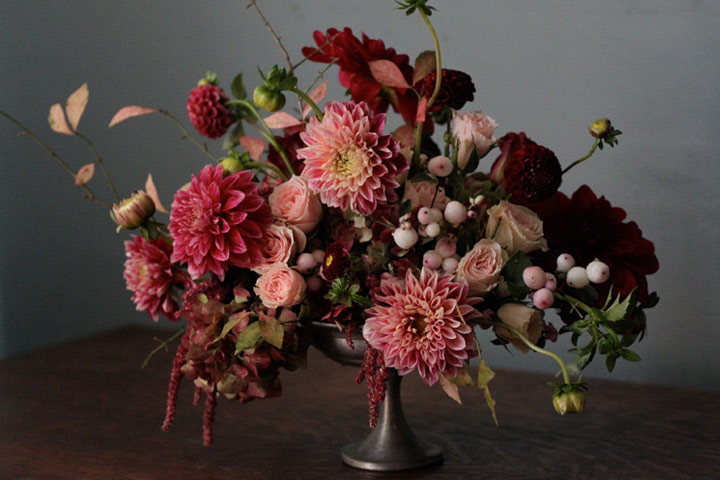
At what (x,y) coordinates should I click in order to perform the action: click on wall. Please return your answer as a coordinate pair (x, y). The height and width of the screenshot is (480, 720). Looking at the image, I should click on (649, 130).